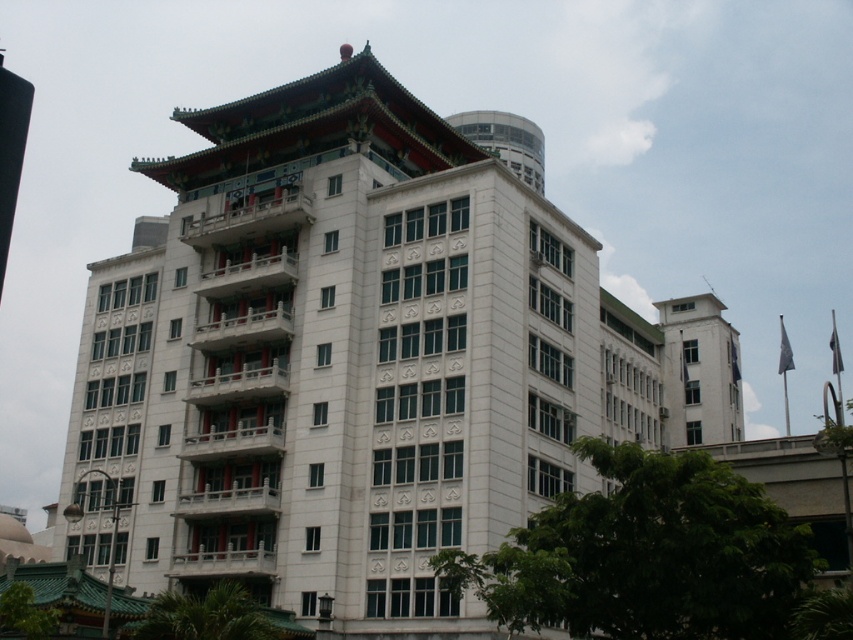
Question: Among these objects, which one is farthest from the camera?

Choices:
 (A) white smooth building at upper right
 (B) white stone building at center

Answer: (A)

Question: Does white stone building at center appear on the left side of white smooth building at upper right?

Choices:
 (A) yes
 (B) no

Answer: (A)

Question: Which point appears farthest from the camera in this image?

Choices:
 (A) (695, 384)
 (B) (408, 355)

Answer: (A)

Question: Is white stone building at center positioned at the back of white smooth building at upper right?

Choices:
 (A) yes
 (B) no

Answer: (B)

Question: Can you confirm if white stone building at center is positioned above white smooth building at upper right?

Choices:
 (A) no
 (B) yes

Answer: (B)